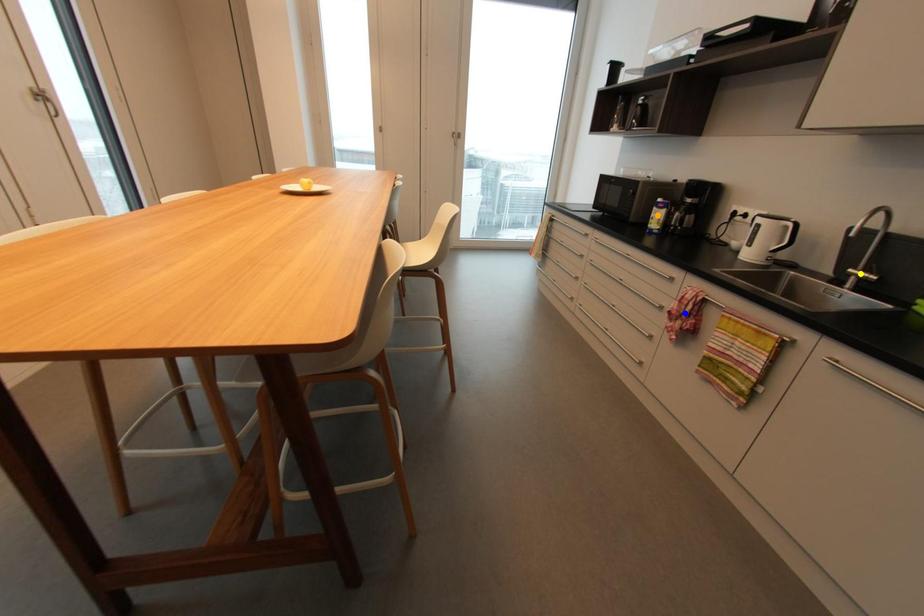
Order these from farthest to nearest:
- yellow point
- orange point
- blue point

1. orange point
2. blue point
3. yellow point